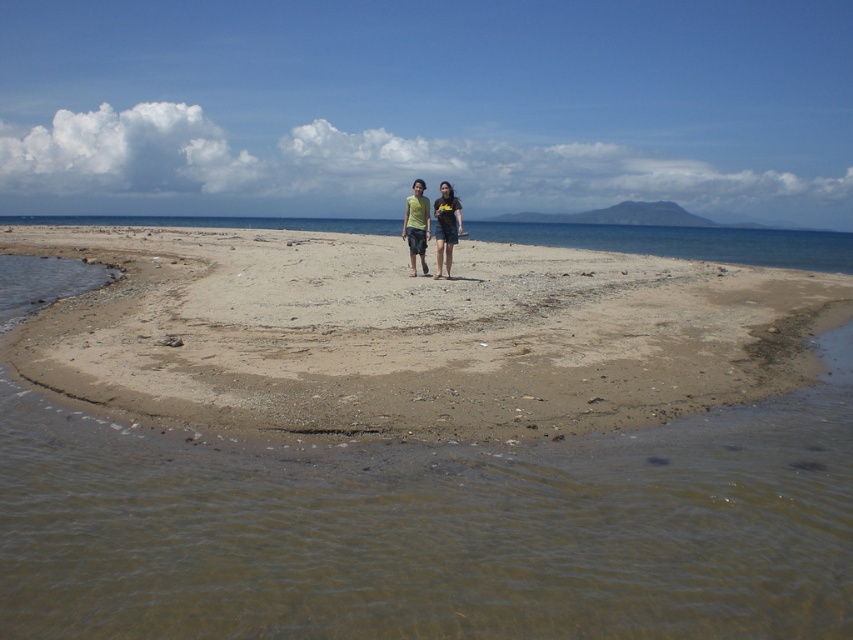
You are standing on the beach and see a point marked at coordinates (416, 225). What is located at that point?

The point at coordinates (416, 225) has a matte green shirt at center located there.

You are a photographer trying to capture a photo of the two people on the beach. You want to ensure both the matte green shirt at center and the dark blue denim shorts at center are clearly visible in your shot. Based on their positions, which object is located to the left?

The matte green shirt at center is positioned on the left side of dark blue denim shorts at center, so the matte green shirt at center is located to the left.

You are standing on the beach and see the matte green shirt at center. Where exactly is it located in terms of coordinates?

The matte green shirt at center is located at coordinates point (416, 225).